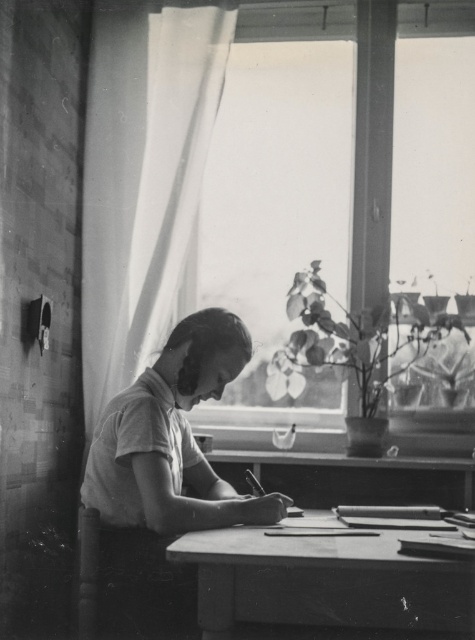
Question: Is transparent glass window at center thinner than wooden table at center?

Choices:
 (A) yes
 (B) no

Answer: (B)

Question: Which object is the farthest from the wooden table at center?

Choices:
 (A) smooth white shirt at center
 (B) transparent glass window at center

Answer: (B)

Question: Which object appears farthest from the camera in this image?

Choices:
 (A) wooden table at center
 (B) transparent glass window at center

Answer: (B)

Question: Which point appears closest to the camera in this image?

Choices:
 (A) (199, 260)
 (B) (380, 532)

Answer: (B)

Question: Can you confirm if smooth white shirt at center is thinner than wooden table at center?

Choices:
 (A) no
 (B) yes

Answer: (B)

Question: Is transparent glass window at center positioned behind smooth white shirt at center?

Choices:
 (A) yes
 (B) no

Answer: (A)